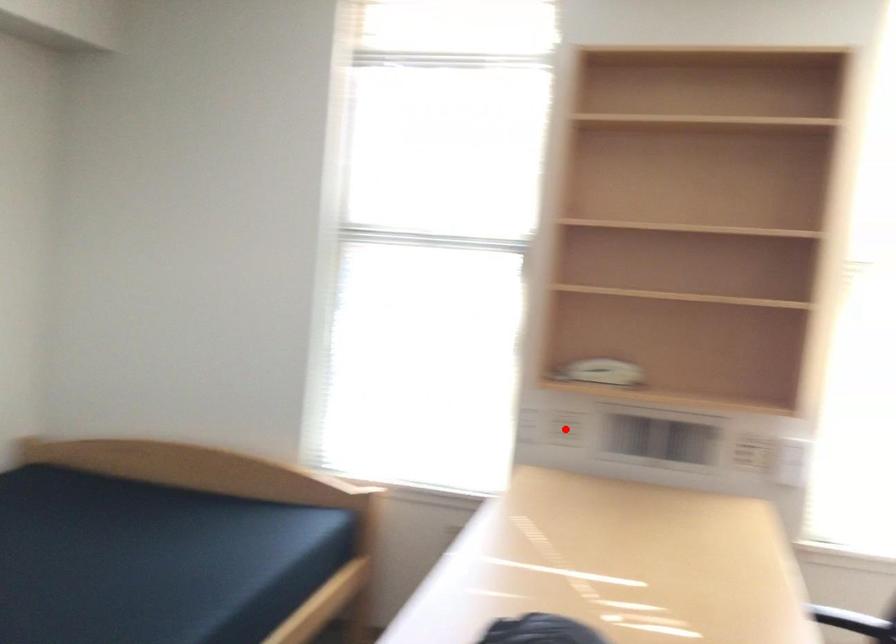
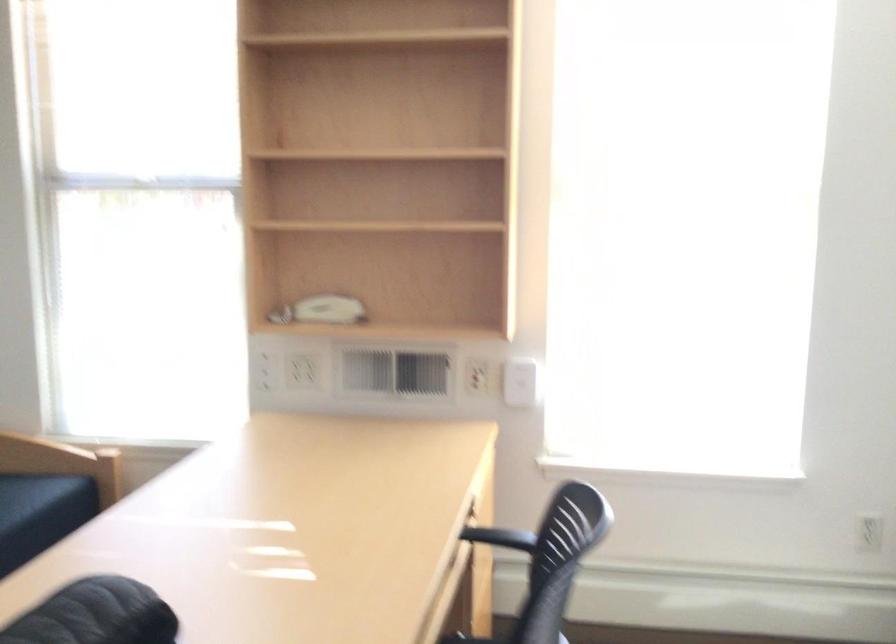
Where in the second image is the point corresponding to the highlighted location from the first image?

(303, 371)